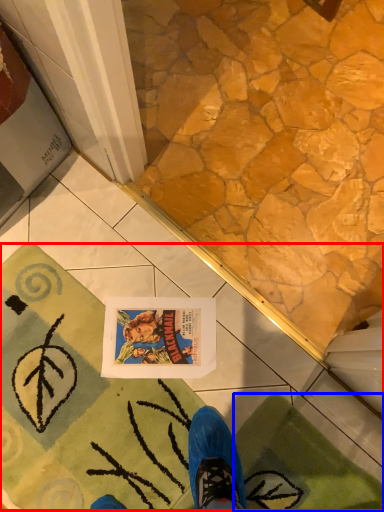
Question: Which object appears closest to the camera in this image, bath mat (highlighted by a red box) or bath mat (highlighted by a blue box)?

Choices:
 (A) bath mat
 (B) bath mat

Answer: (B)